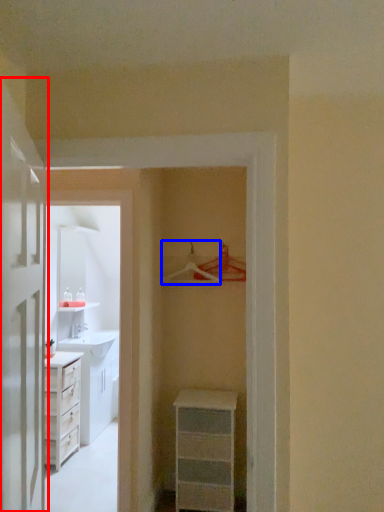
Question: Which object is further to the camera taking this photo, door (highlighted by a red box) or hanger (highlighted by a blue box)?

Choices:
 (A) door
 (B) hanger

Answer: (B)